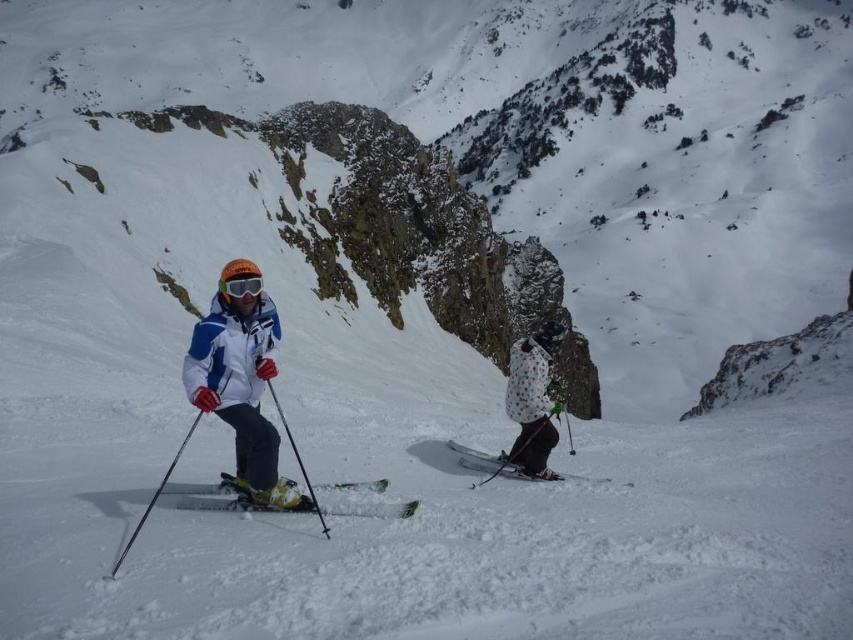
Question: Which point appears farthest from the camera in this image?

Choices:
 (A) (322, 516)
 (B) (503, 456)
 (C) (512, 358)

Answer: (C)

Question: Is white dotted jacket at center positioned at the back of black matte ski pole at left?

Choices:
 (A) no
 (B) yes

Answer: (B)

Question: Is green matte ski at center positioned in front of transparent orange goggles at center?

Choices:
 (A) yes
 (B) no

Answer: (A)

Question: Among these objects, which one is nearest to the camera?

Choices:
 (A) matte black ski pole at center
 (B) white matte ski at center
 (C) white dotted jacket at center

Answer: (A)

Question: Does white matte jacket at center have a larger size compared to transparent orange goggles at center?

Choices:
 (A) yes
 (B) no

Answer: (A)

Question: Which point is closer to the camera?

Choices:
 (A) (126, 541)
 (B) (543, 474)

Answer: (A)